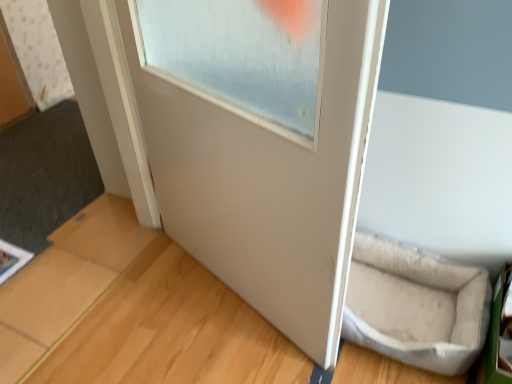
Question: Does white matte door at center lie behind beige fabric pet bed at lower right?

Choices:
 (A) yes
 (B) no

Answer: (B)

Question: Is white matte door at center taller than beige fabric pet bed at lower right?

Choices:
 (A) yes
 (B) no

Answer: (A)

Question: Is beige fabric pet bed at lower right completely or partially inside white matte door at center?

Choices:
 (A) no
 (B) yes

Answer: (A)

Question: Is white matte door at center smaller than beige fabric pet bed at lower right?

Choices:
 (A) yes
 (B) no

Answer: (B)

Question: Is there a large distance between white matte door at center and beige fabric pet bed at lower right?

Choices:
 (A) no
 (B) yes

Answer: (A)

Question: Is light brown wood at lower right wider or thinner than white matte door at center?

Choices:
 (A) thin
 (B) wide

Answer: (B)

Question: From their relative heights in the image, would you say light brown wood at lower right is taller or shorter than white matte door at center?

Choices:
 (A) short
 (B) tall

Answer: (A)

Question: From a real-world perspective, relative to white matte door at center, is light brown wood at lower right vertically above or below?

Choices:
 (A) below
 (B) above

Answer: (A)

Question: Does point (70, 340) appear closer or farther from the camera than point (254, 304)?

Choices:
 (A) closer
 (B) farther

Answer: (A)

Question: Would you say white matte door at center is inside or outside white matte door frame at upper left?

Choices:
 (A) inside
 (B) outside

Answer: (B)

Question: From a real-world perspective, is white matte door at center positioned above or below white matte door frame at upper left?

Choices:
 (A) below
 (B) above

Answer: (B)

Question: From the image's perspective, relative to white matte door frame at upper left, is white matte door at center above or below?

Choices:
 (A) above
 (B) below

Answer: (B)

Question: Is white matte door at center bigger or smaller than white matte door frame at upper left?

Choices:
 (A) big
 (B) small

Answer: (A)

Question: Is white matte door frame at upper left taller or shorter than light brown wood at lower right?

Choices:
 (A) short
 (B) tall

Answer: (B)

Question: Considering their positions, is white matte door frame at upper left located in front of or behind light brown wood at lower right?

Choices:
 (A) behind
 (B) front

Answer: (A)